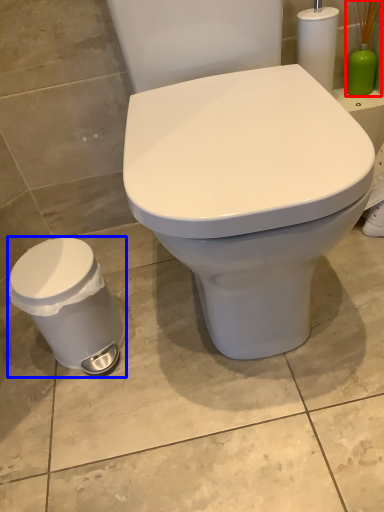
Question: Which point is further to the camera, brush (highlighted by a red box) or porcelain (highlighted by a blue box)?

Choices:
 (A) brush
 (B) porcelain

Answer: (A)